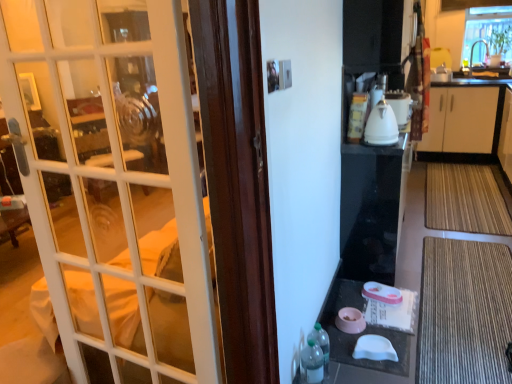
Question: Is white glass door at left positioned behind clear glass window at upper right?

Choices:
 (A) yes
 (B) no

Answer: (B)

Question: Considering the relative sizes of white glass door at left and clear glass window at upper right in the image provided, is white glass door at left taller than clear glass window at upper right?

Choices:
 (A) yes
 (B) no

Answer: (A)

Question: Is white glass door at left facing away from clear glass window at upper right?

Choices:
 (A) yes
 (B) no

Answer: (A)

Question: Is white glass door at left oriented towards clear glass window at upper right?

Choices:
 (A) no
 (B) yes

Answer: (A)

Question: From the image's perspective, would you say white glass door at left is shown under clear glass window at upper right?

Choices:
 (A) yes
 (B) no

Answer: (A)

Question: Relative to translucent plastic bottle at lower right, the 1th bottle positioned from the back, is clear glass window at upper right in front or behind?

Choices:
 (A) front
 (B) behind

Answer: (B)

Question: From a real-world perspective, is clear glass window at upper right physically located above or below translucent plastic bottle at lower right, marked as the 2th bottle in a front-to-back arrangement?

Choices:
 (A) below
 (B) above

Answer: (B)

Question: Considering the relative positions of clear glass window at upper right and translucent plastic bottle at lower right, marked as the 2th bottle in a front-to-back arrangement, in the image provided, is clear glass window at upper right to the left or to the right of translucent plastic bottle at lower right, marked as the 2th bottle in a front-to-back arrangement,?

Choices:
 (A) right
 (B) left

Answer: (A)

Question: From the image's perspective, is clear glass window at upper right located above or below translucent plastic bottle at lower right, marked as the 2th bottle in a front-to-back arrangement?

Choices:
 (A) above
 (B) below

Answer: (A)

Question: In the image, is translucent plastic bottle at lower right, the 2th bottle from the back, positioned in front of or behind white glass door at left?

Choices:
 (A) front
 (B) behind

Answer: (B)

Question: Is translucent plastic bottle at lower right, the 2th bottle from the back, spatially inside white glass door at left, or outside of it?

Choices:
 (A) inside
 (B) outside

Answer: (B)

Question: Does point (303, 352) appear closer or farther from the camera than point (176, 36)?

Choices:
 (A) farther
 (B) closer

Answer: (A)

Question: Based on their positions, is translucent plastic bottle at lower right, the 2th bottle from the back, located to the left or right of white glass door at left?

Choices:
 (A) left
 (B) right

Answer: (B)

Question: From their relative heights in the image, would you say brown textured mat at lower right, the second doormat positioned from the top, is taller or shorter than clear glass window at upper right?

Choices:
 (A) tall
 (B) short

Answer: (B)

Question: Which is correct: brown textured mat at lower right, the second doormat positioned from the top, is inside clear glass window at upper right, or outside of it?

Choices:
 (A) outside
 (B) inside

Answer: (A)